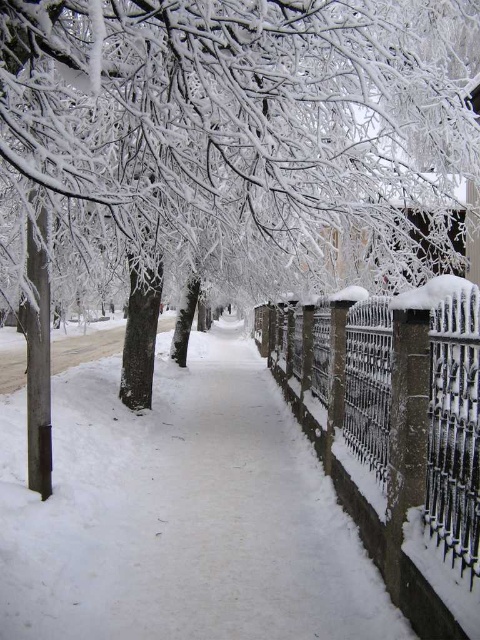
Question: Which of the following is the closest to the observer?

Choices:
 (A) white snow pavement at center
 (B) snow-covered wrought iron fence at right

Answer: (B)

Question: In this image, where is white snow pavement at center located relative to snow-covered wrought iron fence at right?

Choices:
 (A) below
 (B) above

Answer: (A)

Question: Does white snow pavement at center appear over snow-covered wrought iron fence at right?

Choices:
 (A) yes
 (B) no

Answer: (B)

Question: Which object is closer to the camera taking this photo?

Choices:
 (A) white snow pavement at center
 (B) snow-covered wrought iron fence at right

Answer: (B)

Question: Can you confirm if white snow pavement at center is bigger than snow-covered wrought iron fence at right?

Choices:
 (A) no
 (B) yes

Answer: (B)